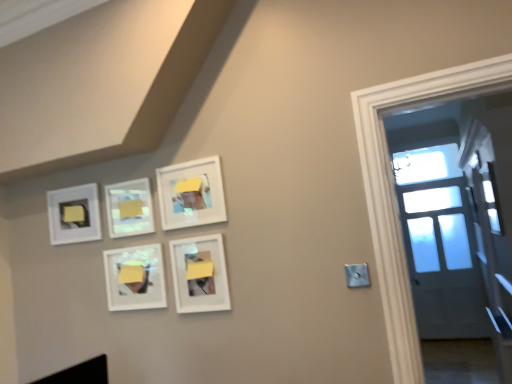
Question: From a real-world perspective, relative to matte white picture frame at upper center, positioned as the 4th picture frame in right-to-left order, is yellow matte paper at upper left, which is the second lift from front to back, vertically above or below?

Choices:
 (A) below
 (B) above

Answer: (B)

Question: Looking at their shapes, would you say yellow matte paper at upper left, which is the second lift from front to back, is wider or thinner than matte white picture frame at upper center, the 2th picture frame when ordered from left to right?

Choices:
 (A) thin
 (B) wide

Answer: (B)

Question: Estimate the real-world distances between objects in this image. Which object is closer to the yellow matte paper at upper left, which appears as the 1th lift when viewed from the left?

Choices:
 (A) matte white picture frame at upper left, which is counted as the 1th picture frame, starting from the left
 (B) matte white picture frame at upper center, the fourth picture frame from the left
 (C) yellow matte paper at upper center, which ranks as the 2th lift in left-to-right order
 (D) matte white picture frame at upper center, the 2th picture frame when ordered from left to right
 (E) white matte picture frame at lower center, the 1th picture frame when ordered from right to left

Answer: (A)

Question: Estimate the real-world distances between objects in this image. Which object is farther from the matte white picture frame at center-left, the 3th picture frame viewed from the right?

Choices:
 (A) matte white picture frame at upper center, the 2th picture frame from the right
 (B) yellow matte paper at upper center, which ranks as the 2th lift in left-to-right order
 (C) white matte picture frame at lower center, which is the 5th picture frame from left to right
 (D) matte white picture frame at upper center, positioned as the 4th picture frame in right-to-left order
 (E) yellow matte paper at upper left, which appears as the 1th lift when viewed from the left

Answer: (E)